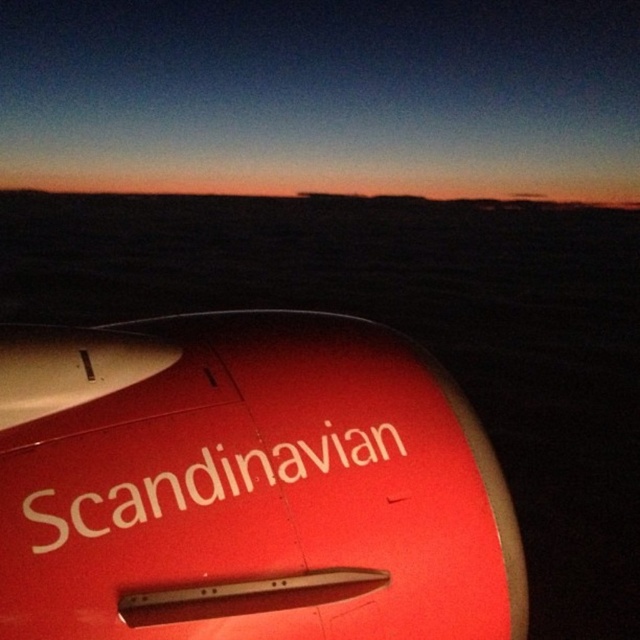
Question: Is matte red airplane at center wider than matte red airplane wing at upper left?

Choices:
 (A) yes
 (B) no

Answer: (A)

Question: Can you confirm if matte red airplane at center is bigger than matte red airplane wing at upper left?

Choices:
 (A) yes
 (B) no

Answer: (A)

Question: Among these points, which one is farthest from the camera?

Choices:
 (A) (330, 460)
 (B) (13, 589)

Answer: (A)

Question: Is the position of matte red airplane at center more distant than that of matte red airplane wing at upper left?

Choices:
 (A) yes
 (B) no

Answer: (B)

Question: Among these points, which one is nearest to the camera?

Choices:
 (A) [292, 460]
 (B) [65, 588]

Answer: (B)